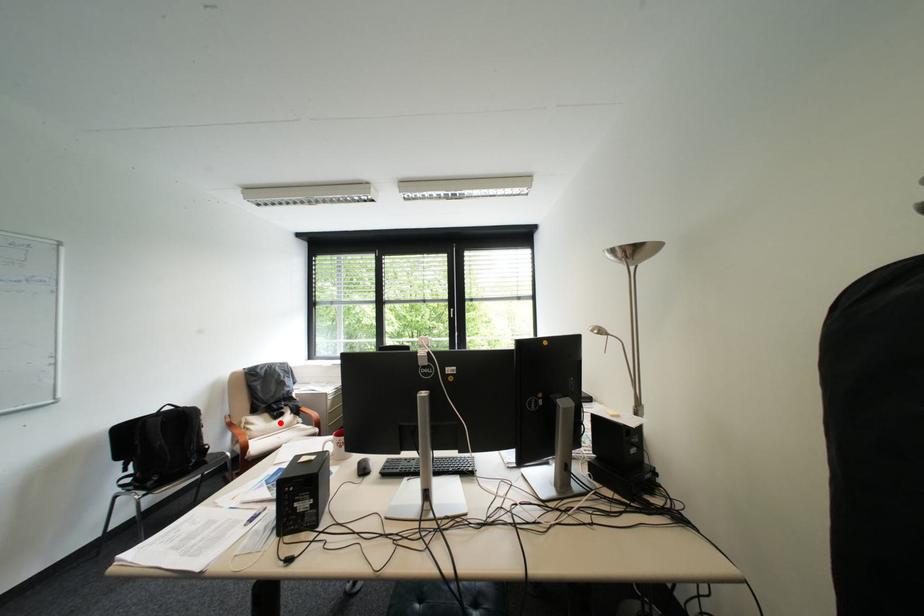
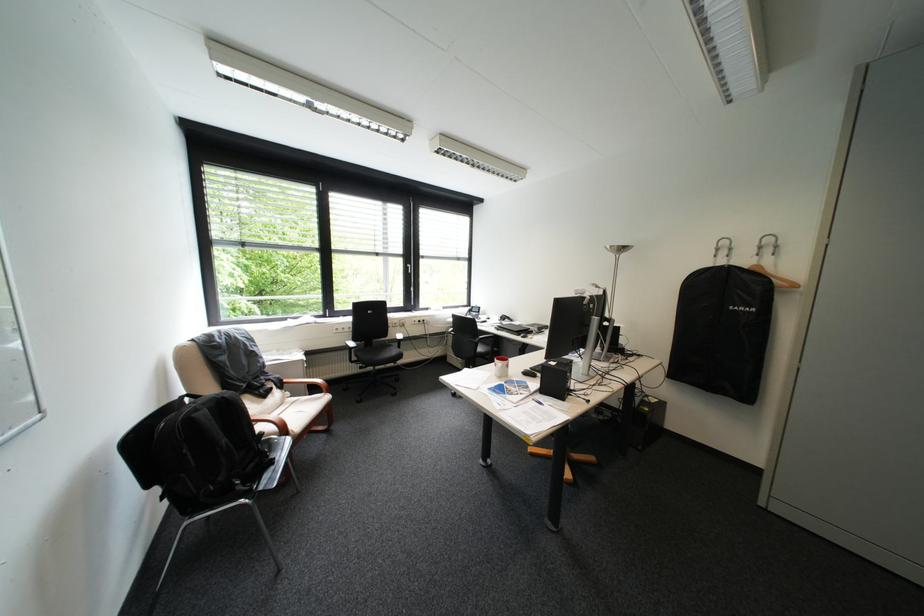
Where in the second image is the point corresponding to the highlighted location from the first image?

(272, 403)